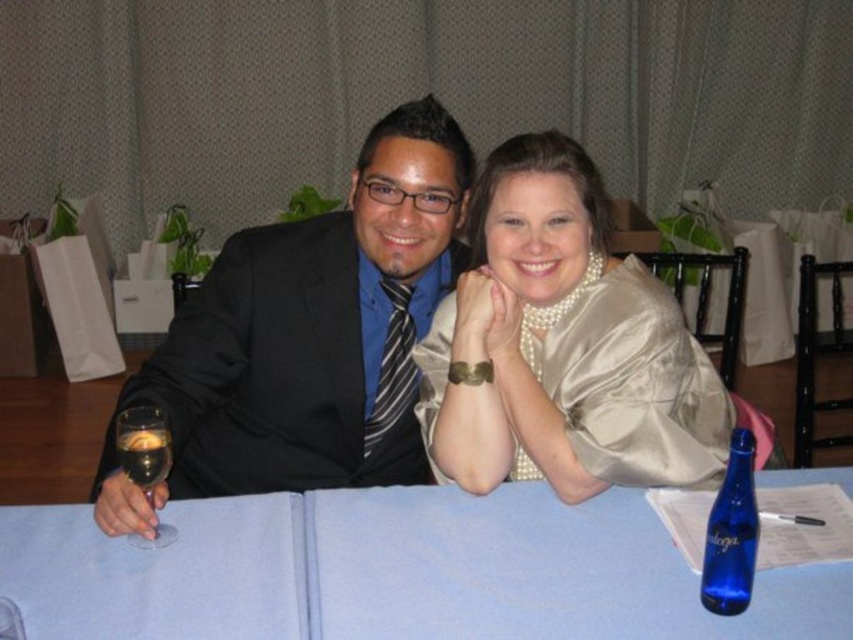
You are a photographer at a formal event. You need to place a small name tag between the satin gold dress at center and the clear glass wine glass at left. The name tag is 3 inches wide. Is there enough space between them to fit the name tag without overlapping?

The satin gold dress at center and clear glass wine glass at left are 23.50 inches apart from each other. Since the name tag is only 3 inches wide, there is more than enough space to place it between them without overlapping.

You are a photographer setting up for a group photo at a formal event. You need to position the group so that they are centered around the blue fabric table at center. Given that the table is located at coordinates point 0.895, 0.462, where should you place the camera to ensure the table is at the center of the frame?

The blue fabric table at center is positioned at point (393, 572), so the camera should be placed directly facing this coordinate to center the table in the frame.

You are a photographer at a formal event. You need to place a decorative item on the table between the blue fabric table at center and the blue glass bottle at lower right. Where should you place it to ensure it is centered between them?

Place the decorative item between the blue fabric table at center and the blue glass bottle at lower right so that it is equidistant from both, ensuring it is centered between them.